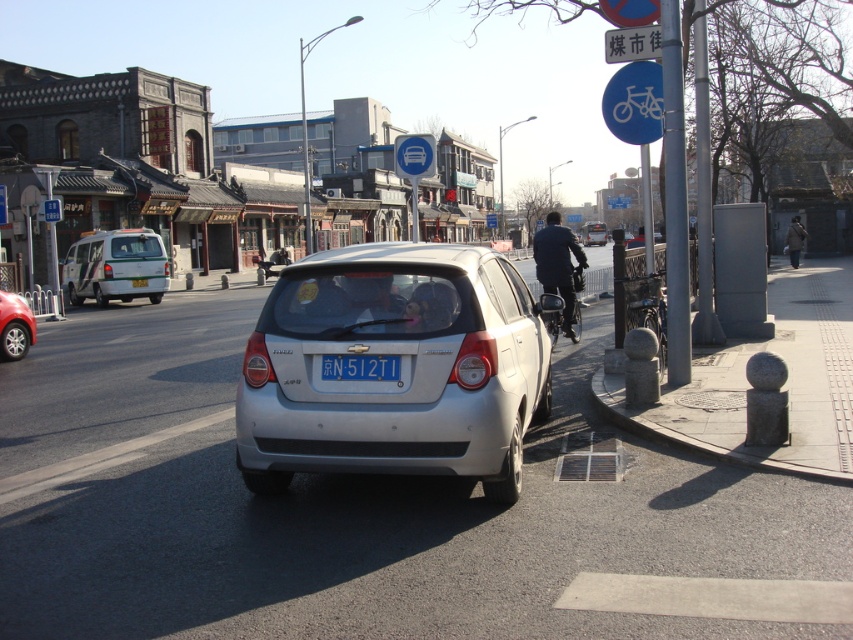
Question: Where is green matte van at center-left located in relation to gray metallic pole at right in the image?

Choices:
 (A) right
 (B) left

Answer: (B)

Question: Among these points, which one is nearest to the camera?

Choices:
 (A) (136, 282)
 (B) (701, 42)

Answer: (B)

Question: Does white plastic street sign at upper center appear over blue plastic sign at center?

Choices:
 (A) no
 (B) yes

Answer: (A)

Question: Which is nearer to the white plastic license plate at center?

Choices:
 (A) brown leather jacket at center
 (B) blue plastic sign at upper center
 (C) satin silver hatchback at center

Answer: (B)

Question: Which point is closer to the camera?

Choices:
 (A) blue metallic license plate at rear
 (B) gray metallic pole at right
 (C) blue plastic sign at upper center
 (D) silver metallic pole at upper right

Answer: (D)

Question: Does satin silver car at center have a larger size compared to silver metallic hatchback at center?

Choices:
 (A) no
 (B) yes

Answer: (B)